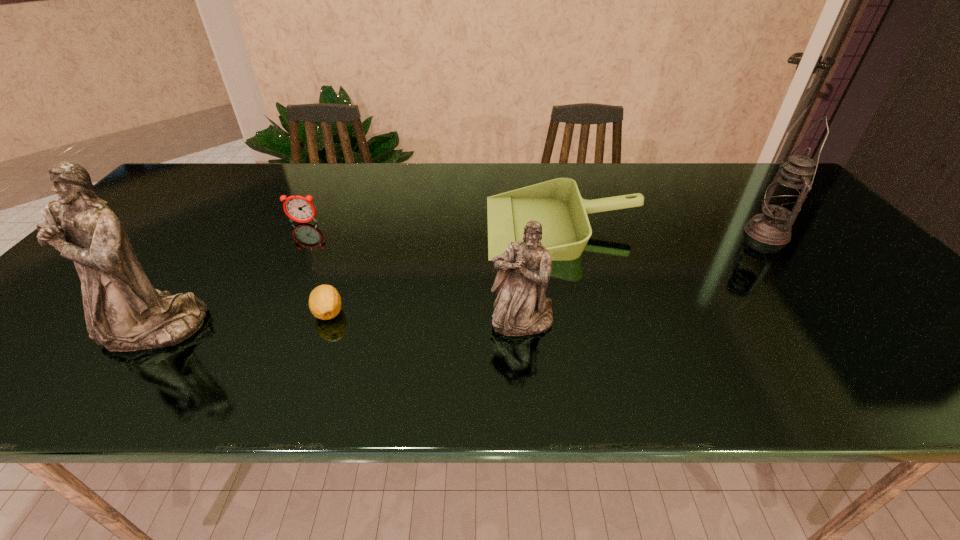
Find the location of `the left figurine`. the left figurine is located at coordinates (123, 311).

Identify the location of the leftmost object. (123, 311).

At what (x,y) coordinates should I click in order to perform the action: click on the right figurine. Please return your answer as a coordinate pair (x, y). The height and width of the screenshot is (540, 960). Looking at the image, I should click on (521, 308).

At what (x,y) coordinates should I click in order to perform the action: click on the shorter figurine. Please return your answer as a coordinate pair (x, y). Looking at the image, I should click on (521, 308).

Identify the location of dustpan. The width and height of the screenshot is (960, 540). (557, 204).

Locate an element on the screen. The width and height of the screenshot is (960, 540). the fifth object from right to left is located at coordinates (300, 209).

At what (x,y) coordinates should I click in order to perform the action: click on the rightmost object. Please return your answer as a coordinate pair (x, y). The width and height of the screenshot is (960, 540). Looking at the image, I should click on (784, 198).

Locate an element on the screen. This screenshot has height=540, width=960. the fifth shortest object is located at coordinates (784, 198).

Locate an element on the screen. The image size is (960, 540). the fourth object from right to left is located at coordinates (324, 301).

At what (x,y) coordinates should I click in order to perform the action: click on lemon. Please return your answer as a coordinate pair (x, y). This screenshot has height=540, width=960. Looking at the image, I should click on (324, 301).